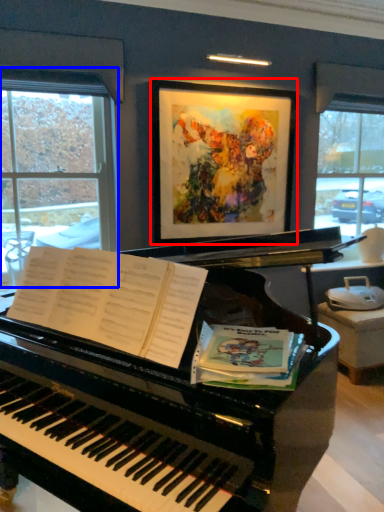
Question: Among these objects, which one is farthest to the camera, picture frame (highlighted by a red box) or window (highlighted by a blue box)?

Choices:
 (A) picture frame
 (B) window

Answer: (A)